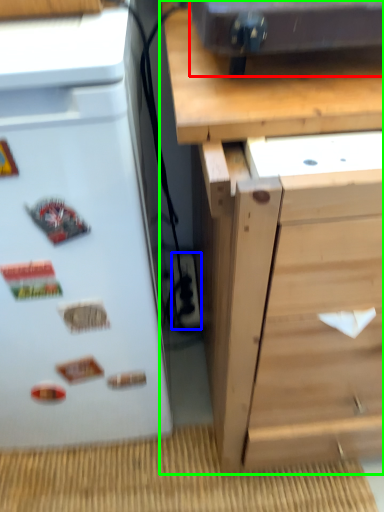
Question: Estimate the real-world distances between objects in this image. Which object is farther from appliance (highlighted by a red box), electric outlet (highlighted by a blue box) or chest of drawers (highlighted by a green box)?

Choices:
 (A) electric outlet
 (B) chest of drawers

Answer: (A)